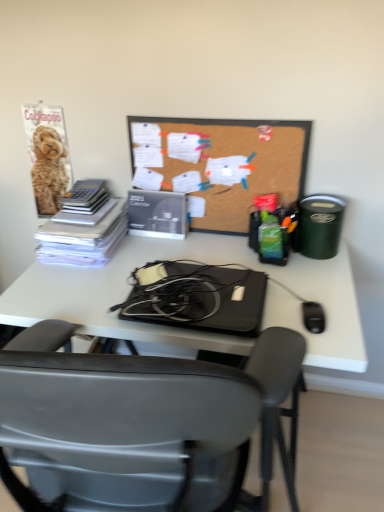
Where is `spots to the right of black plastic mouse at lower right`? The image size is (384, 512). spots to the right of black plastic mouse at lower right is located at coordinates (346, 314).